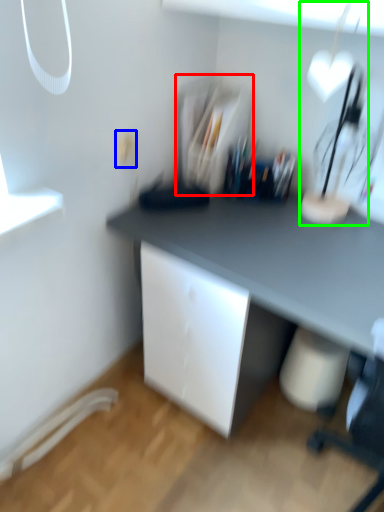
Question: Which object is the farthest from shelf (highlighted by a red box)? Choose among these: electric outlet (highlighted by a blue box) or table lamp (highlighted by a green box).

Choices:
 (A) electric outlet
 (B) table lamp

Answer: (B)